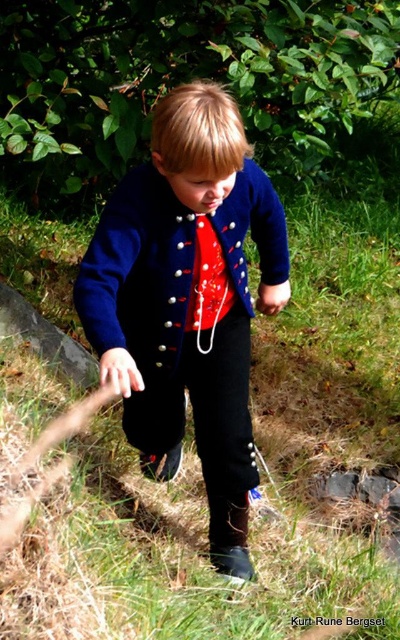
Question: Which of the following is the closest to the observer?

Choices:
 (A) navy wool jacket at center
 (B) green grass at center
 (C) navy woolen jacket at center

Answer: (C)

Question: Is green grass at center below navy wool jacket at center?

Choices:
 (A) no
 (B) yes

Answer: (B)

Question: Does navy woolen jacket at center appear under navy wool jacket at center?

Choices:
 (A) no
 (B) yes

Answer: (B)

Question: Which object is positioned closest to the navy woolen jacket at center?

Choices:
 (A) navy wool jacket at center
 (B) shiny red fabric tie at center
 (C) green grass at center

Answer: (A)

Question: Which of the following is the closest to the observer?

Choices:
 (A) green grass at center
 (B) navy woolen jacket at center
 (C) navy wool jacket at center

Answer: (B)

Question: Can you confirm if green grass at center is positioned to the right of shiny red fabric tie at center?

Choices:
 (A) yes
 (B) no

Answer: (A)